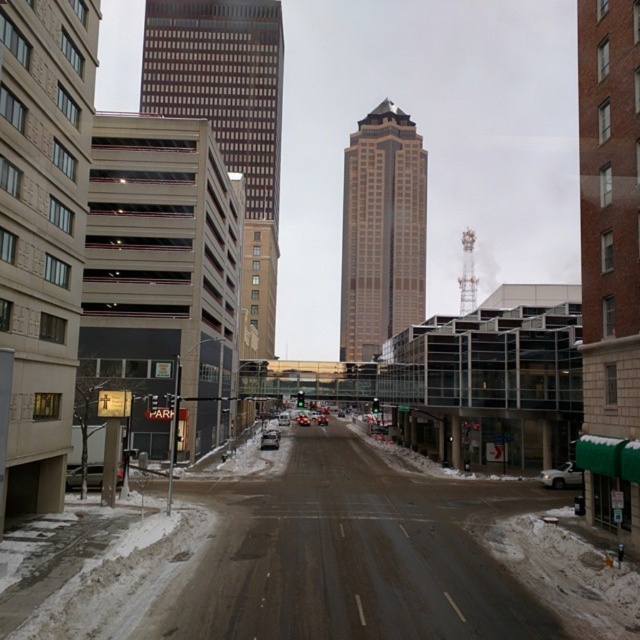
Who is higher up, gold glass skyscraper at center or white matte car at lower right?

gold glass skyscraper at center

Which is below, gold glass skyscraper at center or white matte car at lower right?

white matte car at lower right is below.

You are a GUI agent. You are given a task and a screenshot of the screen. Output one action in this format:
    pyautogui.click(x=<x>, y=<y>)
    Task: Click on the gold glass skyscraper at center
    The image size is (640, 640).
    Given the screenshot: What is the action you would take?
    pyautogui.click(x=381, y=230)

Which is more to the right, gold glass skyscraper at center or silver metallic sedan at lower left?

From the viewer's perspective, gold glass skyscraper at center appears more on the right side.

What do you see at coordinates (381, 230) in the screenshot? Image resolution: width=640 pixels, height=640 pixels. I see `gold glass skyscraper at center` at bounding box center [381, 230].

Where is `gold glass skyscraper at center`? gold glass skyscraper at center is located at coordinates (381, 230).

Measure the distance between brown glass skyscraper at center and camera.

brown glass skyscraper at center is 82.81 meters away from camera.

Does brown glass skyscraper at center have a lesser height compared to silver metallic sedan at lower left?

Incorrect, brown glass skyscraper at center's height does not fall short of silver metallic sedan at lower left's.

Does point (257, 291) come in front of point (76, 470)?

No, it is not.

Find the location of a particular element. The width and height of the screenshot is (640, 640). brown glass skyscraper at center is located at coordinates (228, 116).